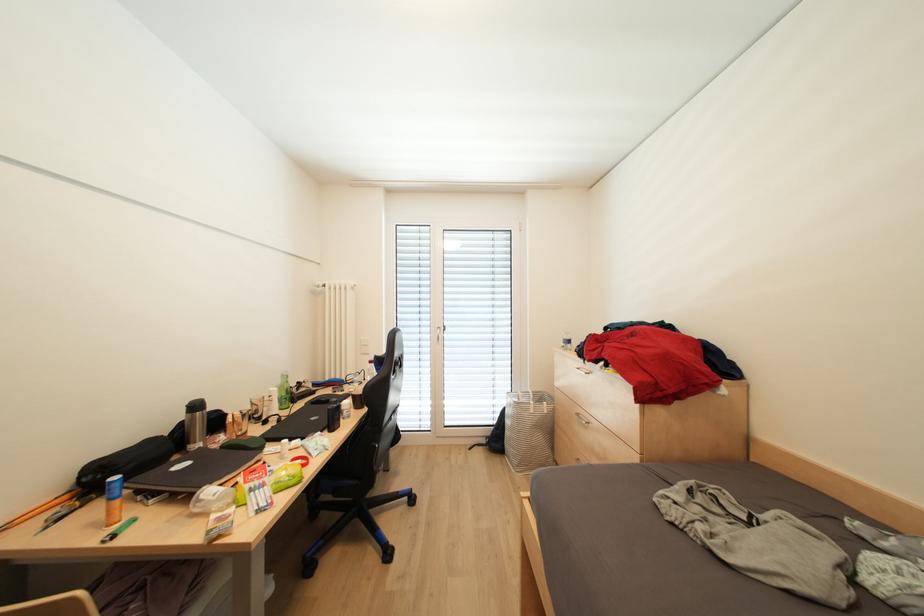
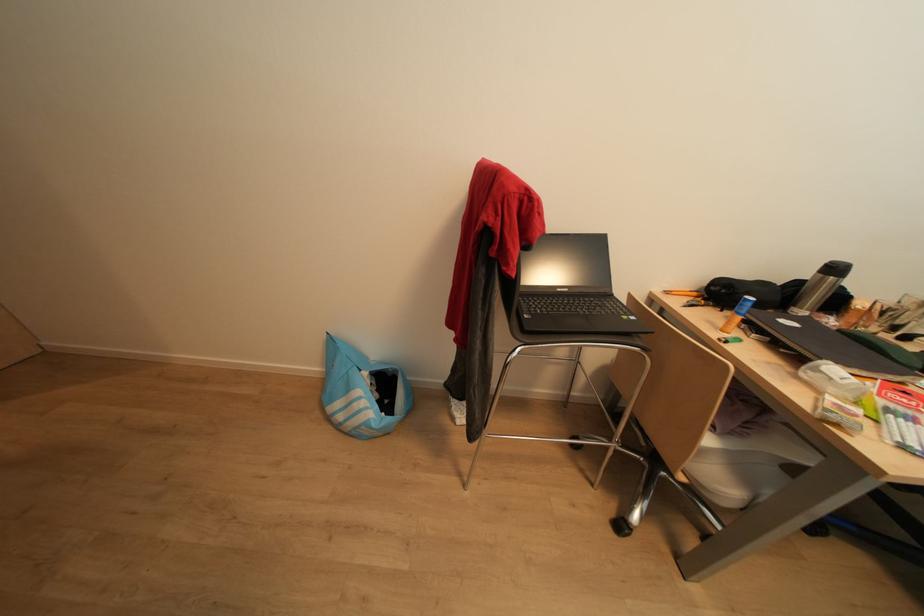
How did the camera likely rotate?

The camera's rotation is toward left-down.